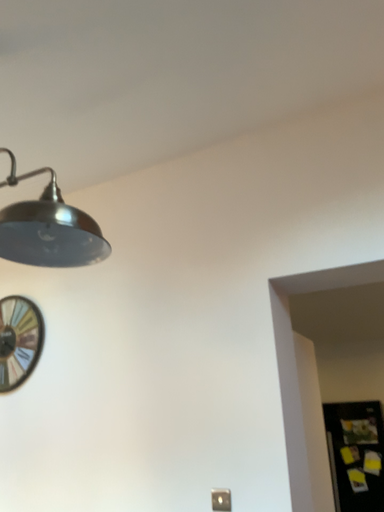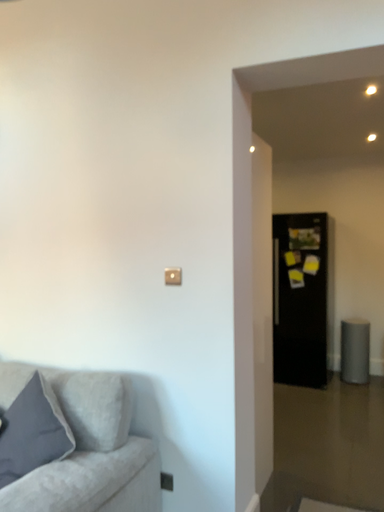
Question: Which way did the camera rotate in the video?

Choices:
 (A) rotated downward
 (B) rotated upward

Answer: (A)